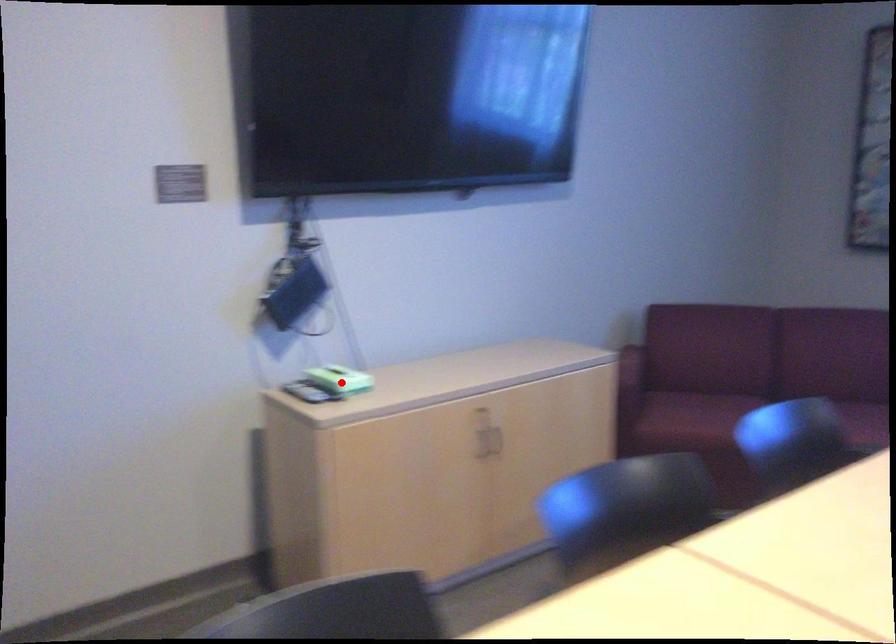
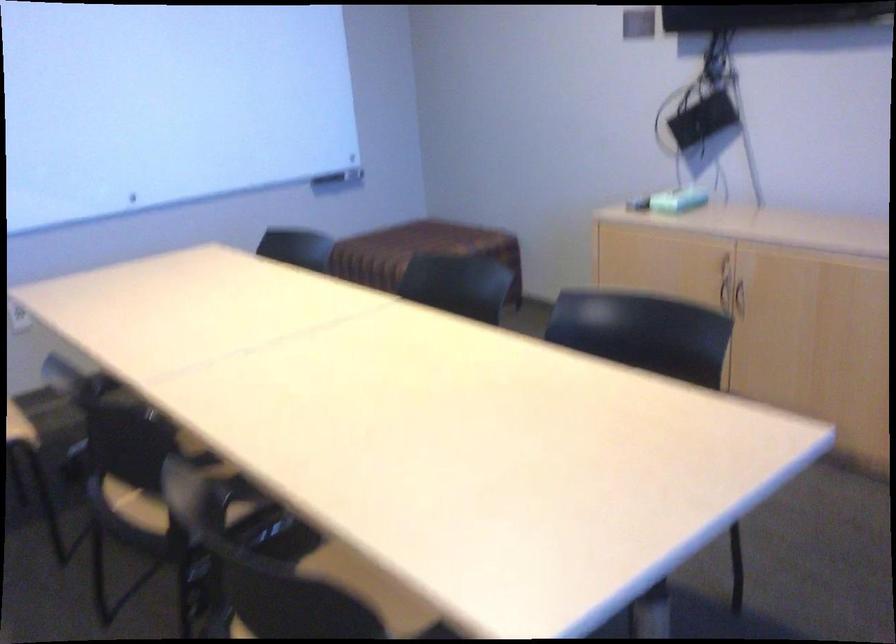
Question: I am providing you with two images of the same scene from different viewpoints. Image1 has a red point marked. In image2, the corresponding 3D location appears at what relative position? Reply with the corresponding letter.

Choices:
 (A) Closer
 (B) Farther

Answer: (B)